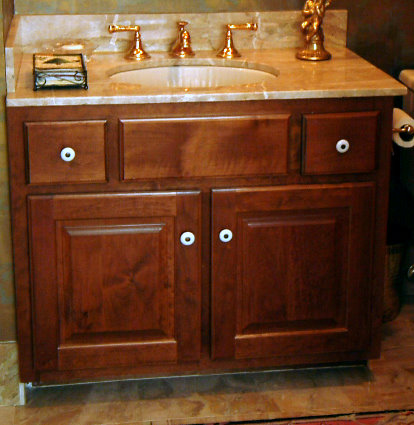
Identify the location of cabinet handles. (189, 236), (226, 231).